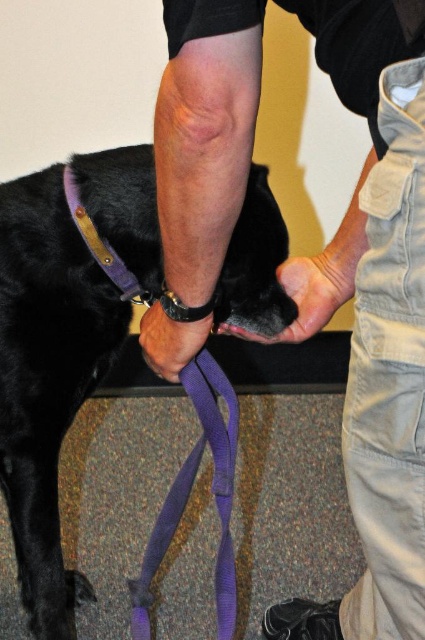
Can you confirm if purple fabric leash at lower left is taller than purple fabric strap at upper left?

Correct, purple fabric leash at lower left is much taller as purple fabric strap at upper left.

Can you confirm if purple fabric leash at lower left is smaller than purple fabric strap at upper left?

No, purple fabric leash at lower left is not smaller than purple fabric strap at upper left.

Where is `purple fabric leash at lower left`? The width and height of the screenshot is (425, 640). purple fabric leash at lower left is located at coordinates (374, 316).

What do you see at coordinates (47, 378) in the screenshot? I see `purple fabric leash at center` at bounding box center [47, 378].

Is purple fabric leash at center further to the viewer compared to purple fabric strap at upper left?

No, it is in front of purple fabric strap at upper left.

Between point (68, 353) and point (115, 280), which one is positioned in front?

Point (115, 280) is more forward.

Where is `purple fabric leash at center`? purple fabric leash at center is located at coordinates (47, 378).

Is purple fabric strap at center smaller than purple fabric strap at upper left?

Actually, purple fabric strap at center might be larger than purple fabric strap at upper left.

Based on the photo, can you confirm if purple fabric strap at center is wider than purple fabric strap at upper left?

Yes.

Where is `purple fabric strap at center`? The image size is (425, 640). purple fabric strap at center is located at coordinates [x=189, y=492].